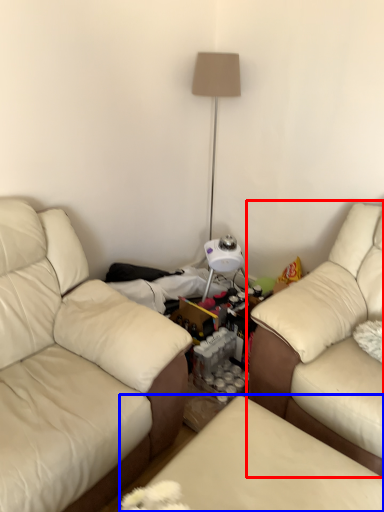
Question: Which object appears closest to the camera in this image, studio couch (highlighted by a red box) or swivel chair (highlighted by a blue box)?

Choices:
 (A) studio couch
 (B) swivel chair

Answer: (B)